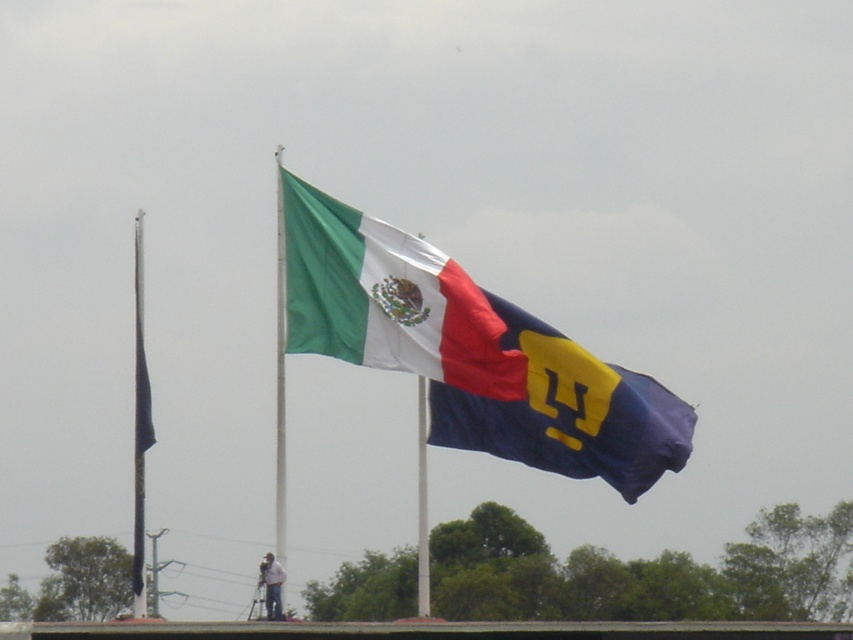
Question: In this image, where is textured cotton flag at center located relative to black matte flag pole at left?

Choices:
 (A) above
 (B) below

Answer: (A)

Question: Which point appears closest to the camera in this image?

Choices:
 (A) tap(302, 218)
 (B) tap(140, 294)
 (C) tap(279, 564)

Answer: (A)

Question: In this image, where is black matte flag pole at left located relative to white fabric man at lower center?

Choices:
 (A) below
 (B) above

Answer: (B)

Question: Is textured cotton flag at center smaller than blue fabric flag at center?

Choices:
 (A) yes
 (B) no

Answer: (A)

Question: Which point is closer to the camera taking this photo?

Choices:
 (A) (138, 237)
 (B) (492, 314)
 (C) (279, 582)

Answer: (B)

Question: Which point is farther to the camera?

Choices:
 (A) (405, 259)
 (B) (663, 458)

Answer: (B)